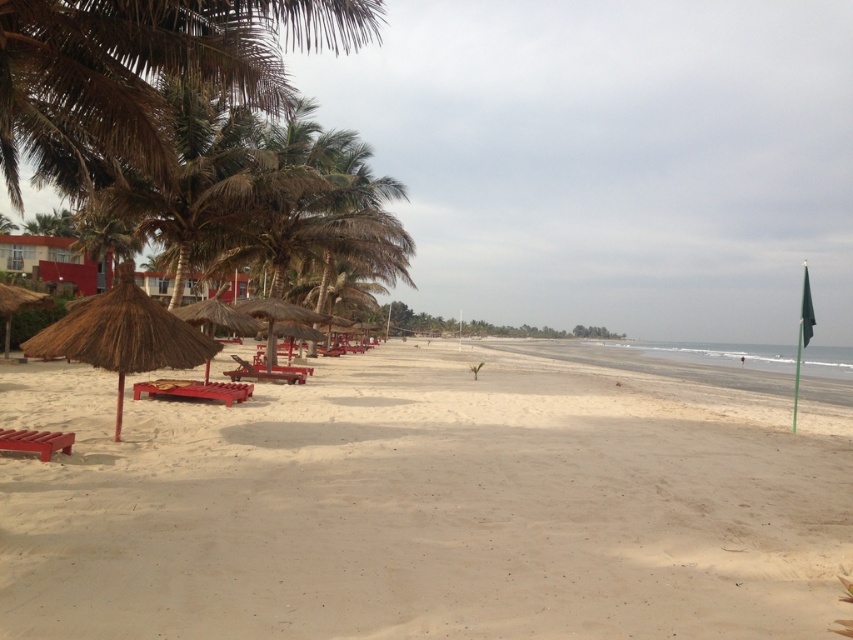
Question: Which of the following is the closest to the observer?

Choices:
 (A) (270, 356)
 (B) (201, 360)

Answer: (B)

Question: Is the position of beige sandy beach at left less distant than that of brown thatch umbrella at center?

Choices:
 (A) no
 (B) yes

Answer: (B)

Question: Can you confirm if beige sandy beach at left is smaller than brown thatch umbrella at center?

Choices:
 (A) yes
 (B) no

Answer: (B)

Question: Which point is closer to the camera?

Choices:
 (A) (776, 561)
 (B) (131, 320)

Answer: (A)

Question: Is beige sandy beach at left bigger than thatched straw umbrella at left?

Choices:
 (A) no
 (B) yes

Answer: (B)

Question: Which object appears closest to the camera in this image?

Choices:
 (A) brown thatch umbrella at center
 (B) beige sandy beach at left

Answer: (B)